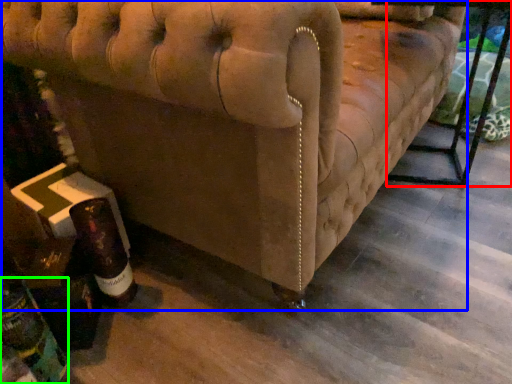
Question: Which object is positioned closest to table (highlighted by a red box)? Select from furniture (highlighted by a blue box) and bottle (highlighted by a green box).

Choices:
 (A) furniture
 (B) bottle

Answer: (A)